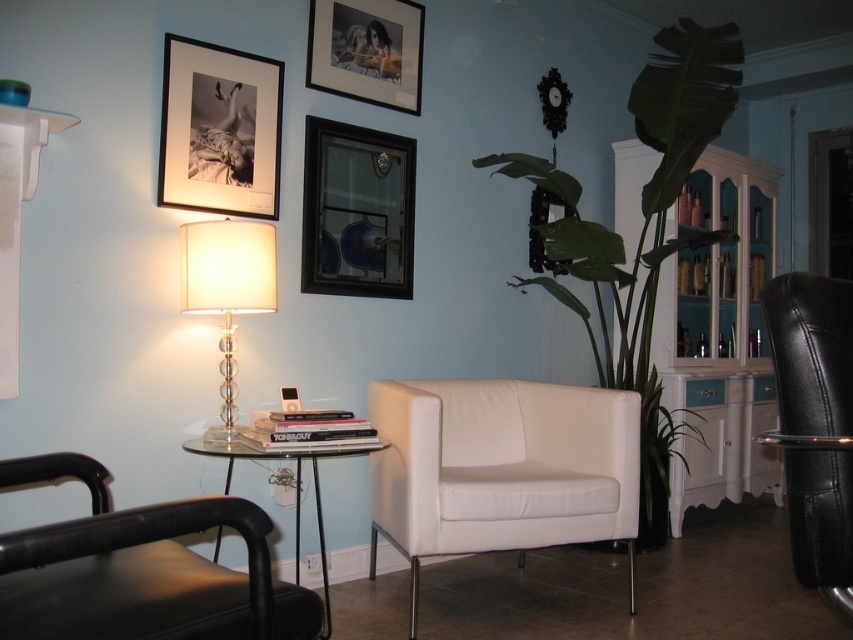
Does white leather couch at center have a larger size compared to white painted wood cabinet at right?

Actually, white leather couch at center might be smaller than white painted wood cabinet at right.

Who is more distant from viewer, (426, 420) or (737, 250)?

The point (737, 250) is more distant.

Is point (410, 566) more distant than point (750, 285)?

No.

This screenshot has height=640, width=853. What are the coordinates of `white leather couch at center` in the screenshot? It's located at (500, 468).

Which of these two, matte black picture frame at upper left or dark wood picture frame at upper center, stands shorter?

matte black picture frame at upper left

From the picture: Is matte black picture frame at upper left below dark wood picture frame at upper center?

No.

Identify the location of matte black picture frame at upper left. The height and width of the screenshot is (640, 853). (219, 129).

Find the location of a particular element. matte black picture frame at upper left is located at coordinates click(219, 129).

How far apart are dark wood picture frame at upper center and clear glass table lamp at upper left?

The distance of dark wood picture frame at upper center from clear glass table lamp at upper left is 23.96 inches.

Who is more distant from viewer, [376,256] or [207,236]?

Point [376,256]

Which is in front, point (328, 140) or point (234, 408)?

Point (234, 408)

Locate an element on the screen. dark wood picture frame at upper center is located at coordinates (357, 211).